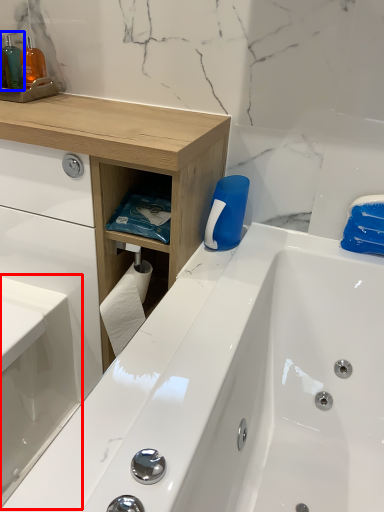
Question: Which object is closer to the camera taking this photo, sink (highlighted by a red box) or toiletry (highlighted by a blue box)?

Choices:
 (A) sink
 (B) toiletry

Answer: (A)